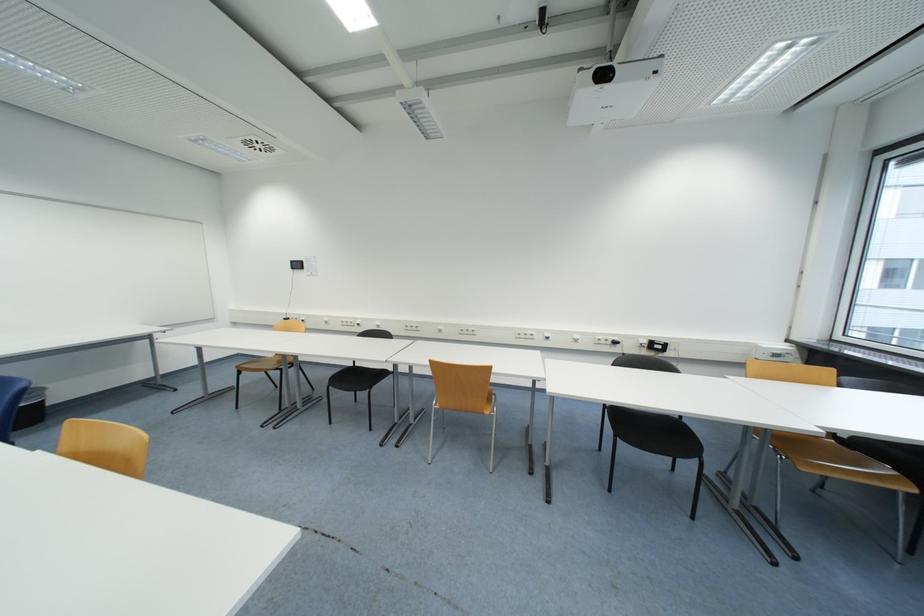
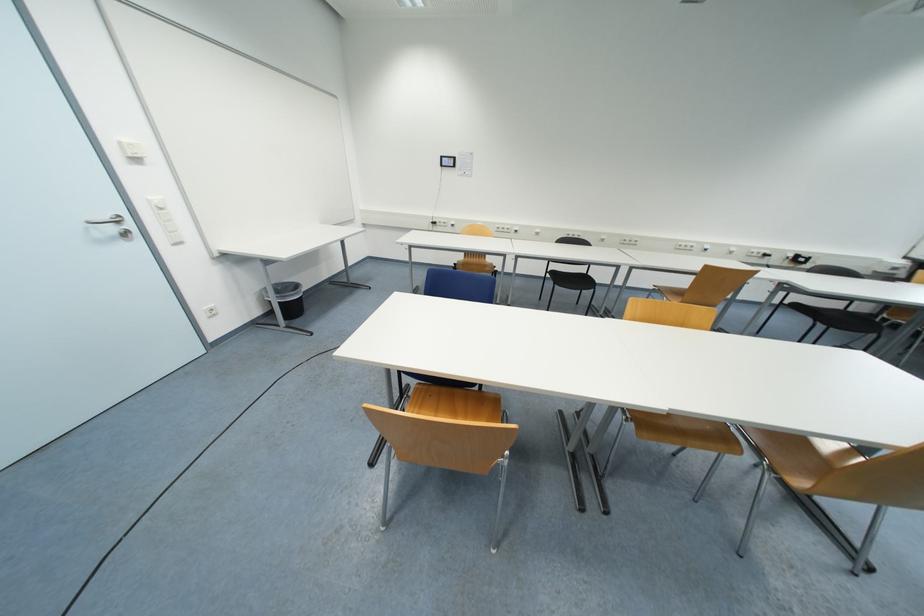
In the second image, find the point that corresponds to point 383,328 in the first image.

(541, 236)